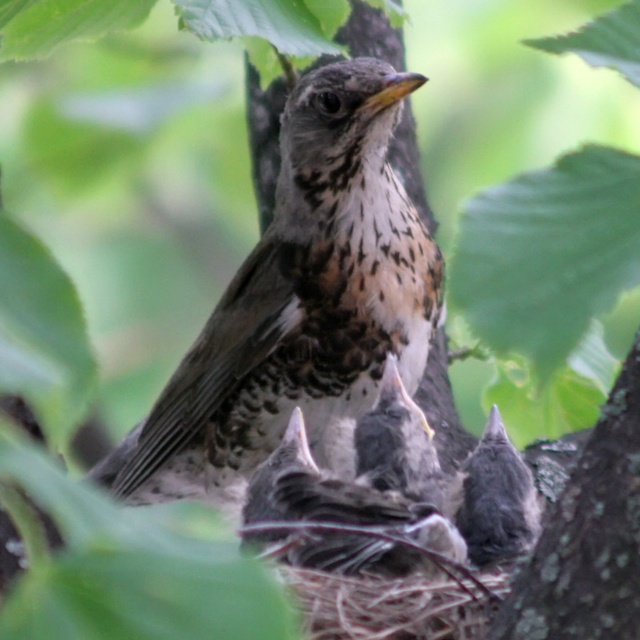
You are a wildlife photographer trying to capture a close shot of the speckled feathered bird at center and the gray speckled feathers at center. Your camera has a depth of field that can focus on objects within a 40 cm range. Can both subjects be in focus simultaneously?

The speckled feathered bird at center is 40.59 centimeters away from the gray speckled feathers at center. Since the distance between them exceeds the camera lens depth of field range of 40 cm, both subjects cannot be in focus at the same time.

Based on the coordinates provided, where is the speckled feathered bird at center located in the image?

The speckled feathered bird at center is located at the 2D coordinates point (300, 298) in the image.

You are a wildlife photographer observing the speckled feathered bird at center and the gray speckled feathers at center in the image. Which object is positioned higher in the scene?

The speckled feathered bird at center is positioned higher than the gray speckled feathers at center because it is above them in the scene.